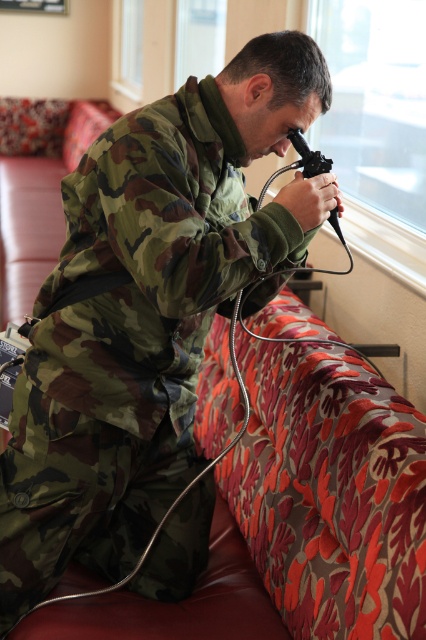
You are a maintenance worker needing to reach the transparent glass window at upper center to clean it. You have a ladder that is 2.5 meters long. The floral fabric couch at lower left is in the way. Can you move the ladder between them?

The distance between the transparent glass window at upper center and the floral fabric couch at lower left is 3.05 meters. Since the ladder is 2.5 meters long, it is shorter than the gap between them. Therefore, the ladder can fit through the space between the transparent glass window at upper center and the floral fabric couch at lower left.

You are a drone operator who needs to exit the room through the transparent glass window at upper center. The window is at coordinates 0.197, 0.885. Your drone has a 0.15 meter radius. Can your drone fit through the window?

The transparent glass window at upper center is located at coordinates (377, 125). Since the drone has a 0.15 meter radius, it can fit through the window as long as the window dimensions are sufficient. However, the provided information does not specify the window size, so we cannot confirm based on the given data.

You are a visitor in a military facility. You see a transparent glass window at upper center and a floral fabric couch at lower left. Which object is positioned to the right of the other?

The transparent glass window at upper center is to the right of the floral fabric couch at lower left.